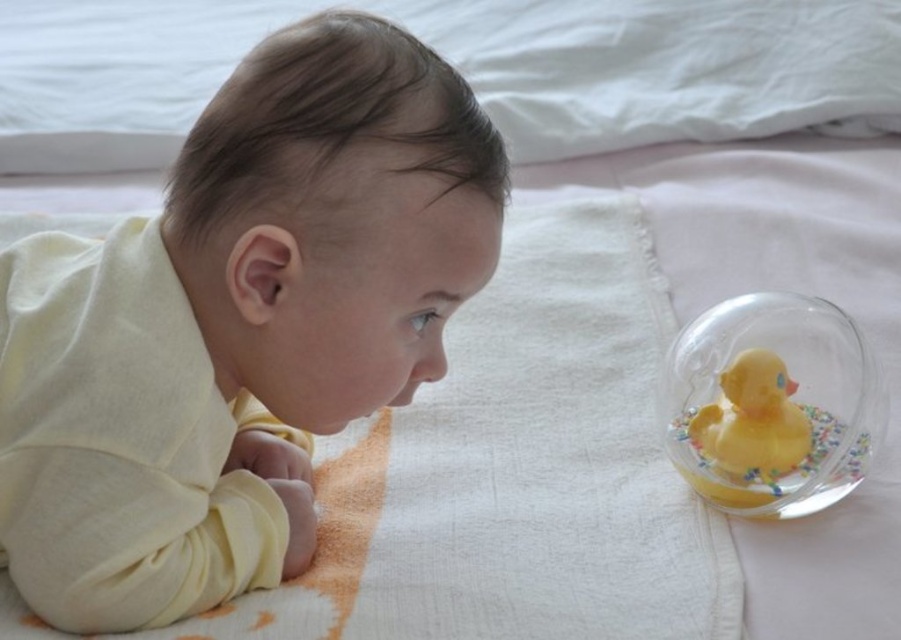
Question: Among these objects, which one is nearest to the camera?

Choices:
 (A) transparent glass bowl at right
 (B) yellow rubber duck at right
 (C) soft yellow fabric at center

Answer: (C)

Question: Observing the image, what is the correct spatial positioning of transparent glass bowl at right in reference to yellow rubber duck at right?

Choices:
 (A) right
 (B) left

Answer: (A)

Question: Among these points, which one is farthest from the camera?

Choices:
 (A) (810, 390)
 (B) (743, 436)

Answer: (A)

Question: Does soft yellow fabric at center lie behind transparent glass bowl at right?

Choices:
 (A) yes
 (B) no

Answer: (B)

Question: Which of the following is the farthest from the observer?

Choices:
 (A) yellow rubber duck at right
 (B) transparent glass bowl at right
 (C) soft yellow fabric at center

Answer: (A)

Question: Is soft yellow fabric at center smaller than transparent glass bowl at right?

Choices:
 (A) no
 (B) yes

Answer: (A)